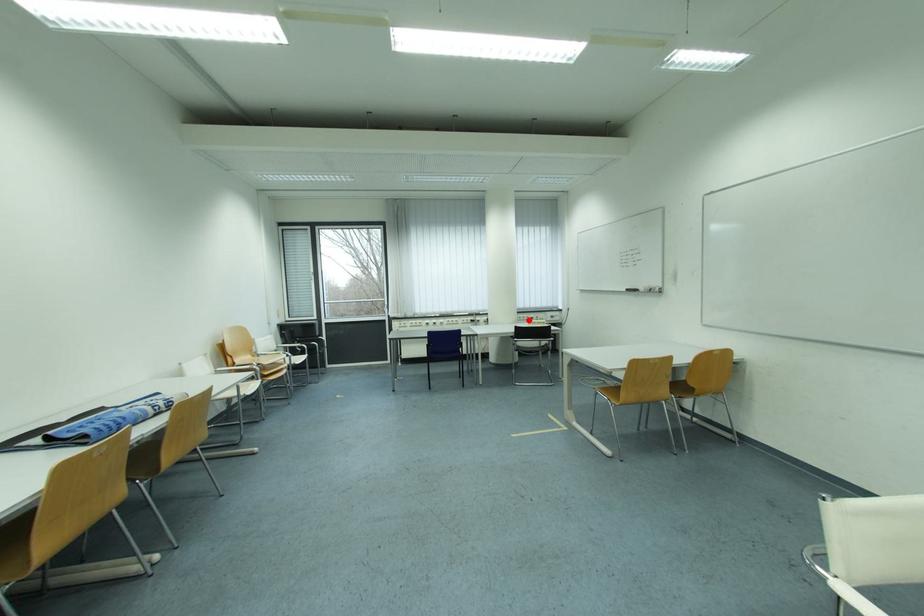
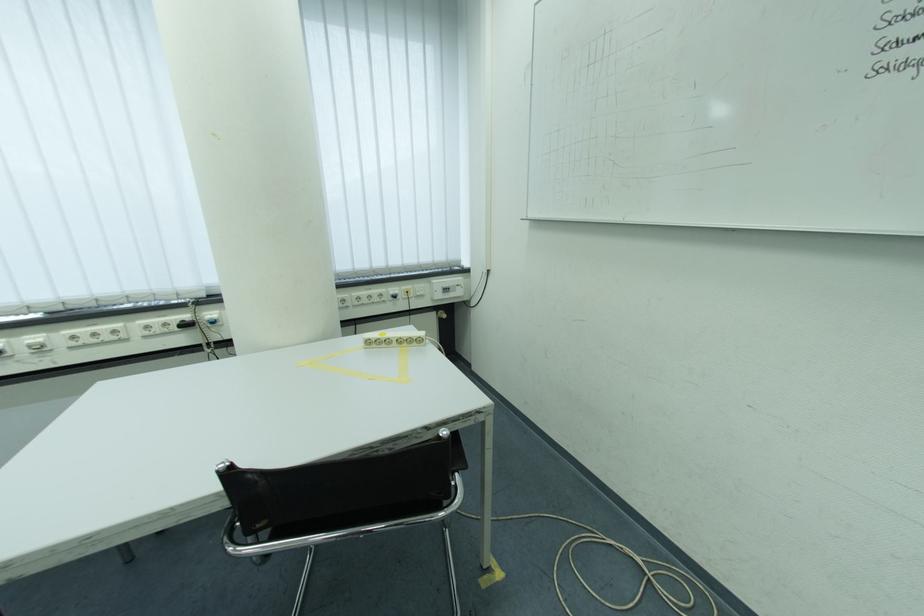
Question: I am providing you with two images of the same scene from different viewpoints. Given a red point in image1, look at the same physical point in image2. Is it:

Choices:
 (A) Closer to the viewpoint
 (B) Farther from the viewpoint

Answer: (A)